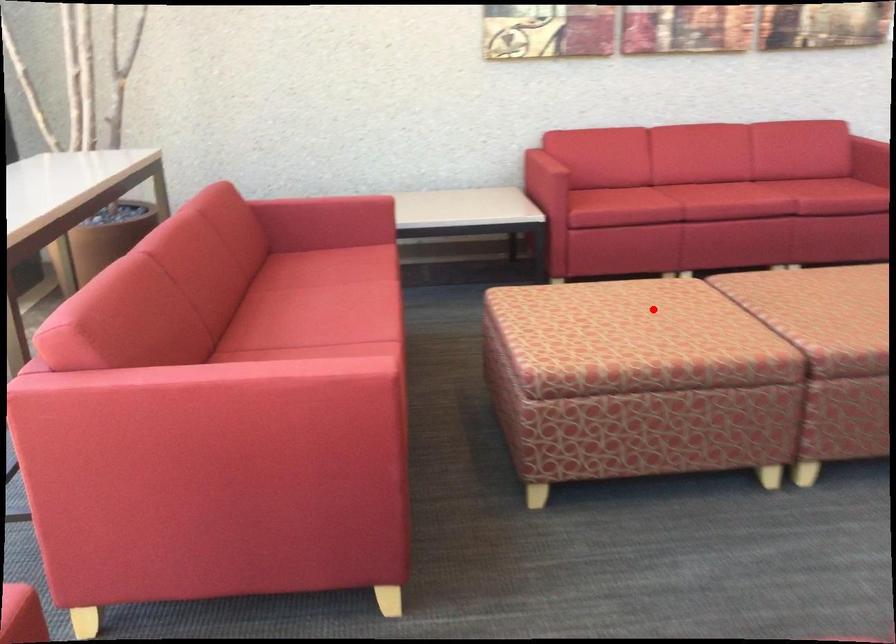
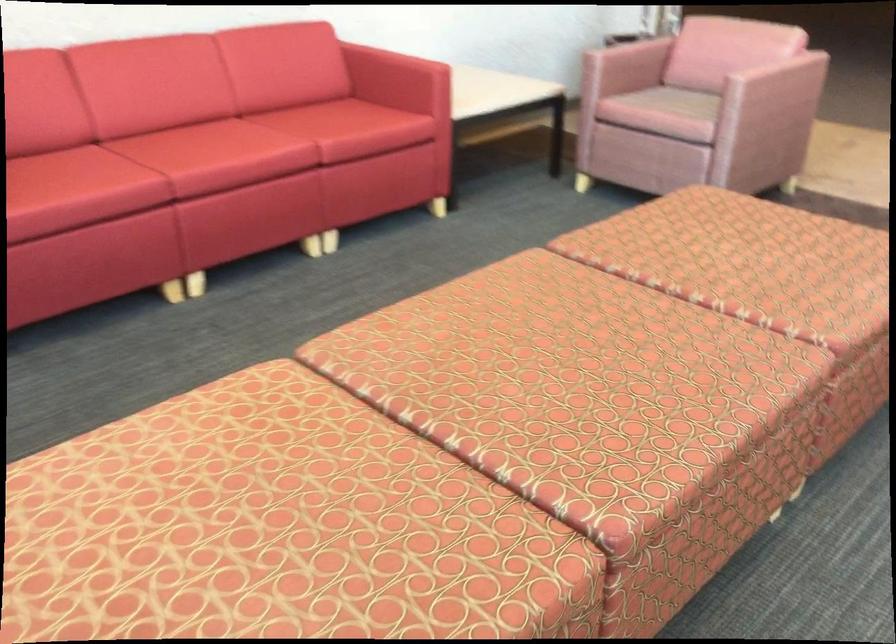
Question: A red point is marked in image1. In image2, is the corresponding 3D point closer to the camera or farther? Reply with the corresponding letter.

Choices:
 (A) The corresponding 3D point is closer.
 (B) The corresponding 3D point is farther.

Answer: (A)